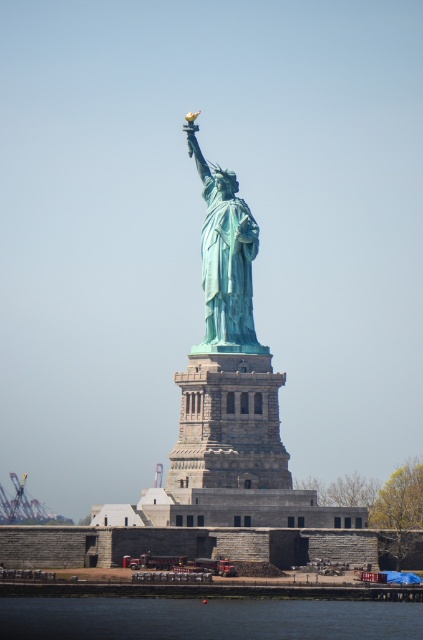
Question: Which of the following is the farthest from the observer?

Choices:
 (A) (225, 182)
 (B) (131, 636)

Answer: (A)

Question: Can you confirm if transparent water at lower center is thinner than green patina statue at center?

Choices:
 (A) yes
 (B) no

Answer: (B)

Question: Can you confirm if transparent water at lower center is positioned to the right of green patina statue at center?

Choices:
 (A) no
 (B) yes

Answer: (B)

Question: Does transparent water at lower center have a larger size compared to green patina statue at center?

Choices:
 (A) no
 (B) yes

Answer: (A)

Question: Which object is closer to the camera taking this photo?

Choices:
 (A) green patina statue at center
 (B) transparent water at lower center

Answer: (B)